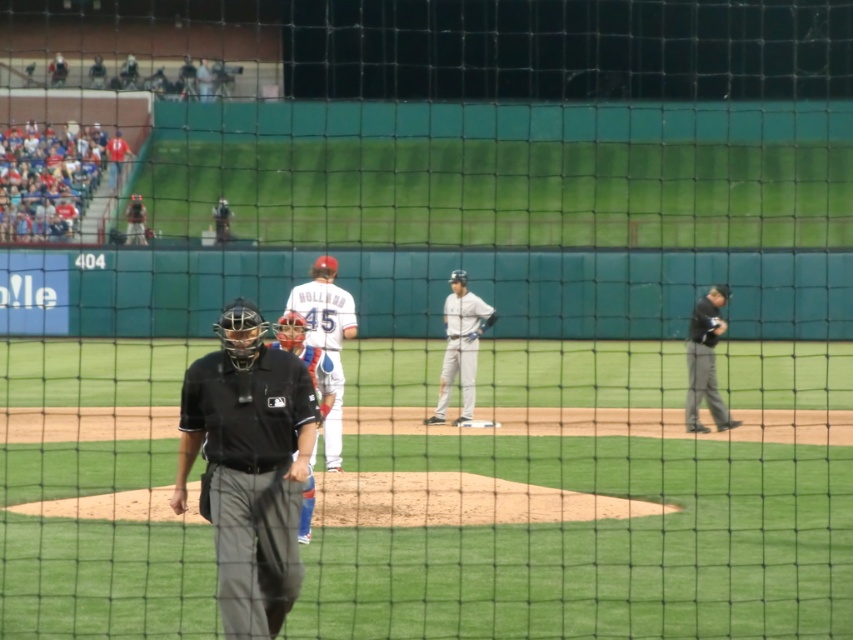
You are a photographer trying to capture a closeup of the gray matte uniform at center and the matte black umpire at upper center through the netting. Which object will appear smaller in the photo?

The gray matte uniform at center will appear smaller in the photo because it has a lesser width compared to the matte black umpire at upper center.

You are a spectator at the baseball game and want to take a photo of both the white matte uniform at center and the white uniformed man at upper left. Which one should you focus on first to ensure both are in the frame?

You should focus on the white uniformed man at upper left first because the white matte uniform at center is to the right of him, so adjusting the frame to include him first will allow the other to be captured to the right within the same shot.

You are a photographer trying to capture a clear shot of the matte black umpire at upper center and the matte black helmet at upper center through the netting. Considering their sizes, which one will appear larger in your photo?

The matte black umpire at upper center is much taller than the matte black helmet at upper center, so the umpire will appear larger in the photo.